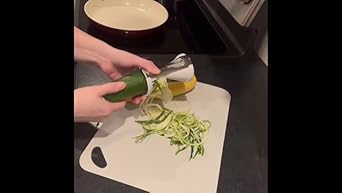
Where is `counter`? The image size is (342, 193). counter is located at coordinates (259, 159).